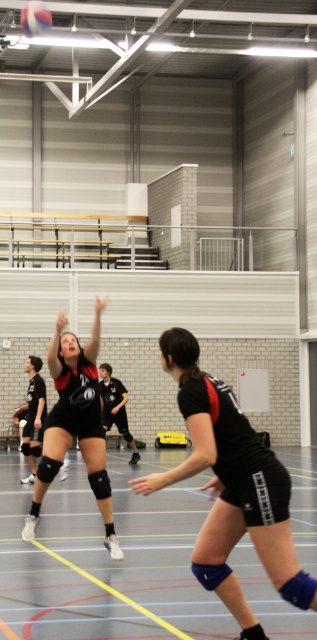
Who is higher up, rubberized black volleyball court at center or white matte volleyball at upper left?

white matte volleyball at upper left is above.

Between rubberized black volleyball court at center and white matte volleyball at upper left, which one appears on the right side from the viewer's perspective?

rubberized black volleyball court at center

This screenshot has height=640, width=317. In order to click on rubberized black volleyball court at center in this screenshot , I will do `click(107, 560)`.

Can you confirm if black matte shorts at center is wider than black matte uniform at center?

Incorrect, black matte shorts at center's width does not surpass black matte uniform at center's.

Does point (240, 616) come closer to viewer compared to point (103, 305)?

Yes, point (240, 616) is closer to viewer.

At what (x,y) coordinates should I click in order to perform the action: click on black matte shorts at center. Please return your answer as a coordinate pair (x, y). Looking at the image, I should click on (231, 486).

Is point (79, 356) more distant than point (21, 28)?

No, (79, 356) is closer to viewer.

Does black matte uniform at center have a greater height compared to white matte volleyball at upper left?

Yes.

The width and height of the screenshot is (317, 640). I want to click on black matte uniform at center, so (75, 422).